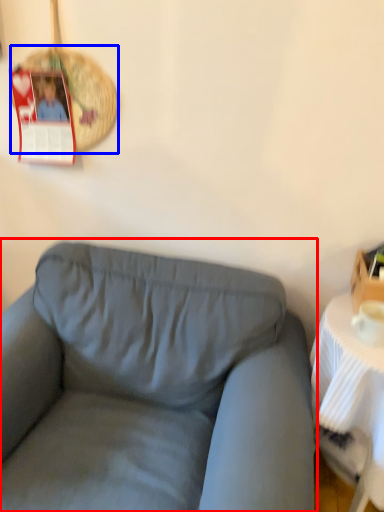
Question: Which object is further to the camera taking this photo, studio couch (highlighted by a red box) or basket (highlighted by a blue box)?

Choices:
 (A) studio couch
 (B) basket

Answer: (B)